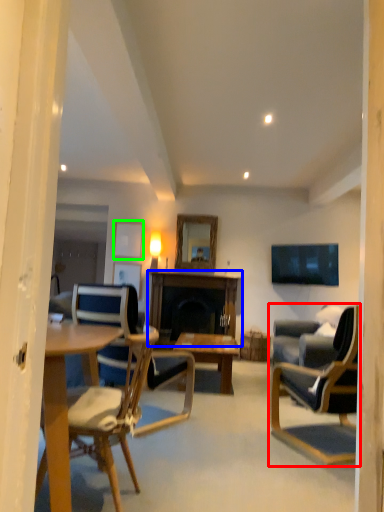
Question: Based on their relative distances, which object is nearer to chair (highlighted by a red box)? Choose from table (highlighted by a blue box) and picture frame (highlighted by a green box).

Choices:
 (A) table
 (B) picture frame

Answer: (A)